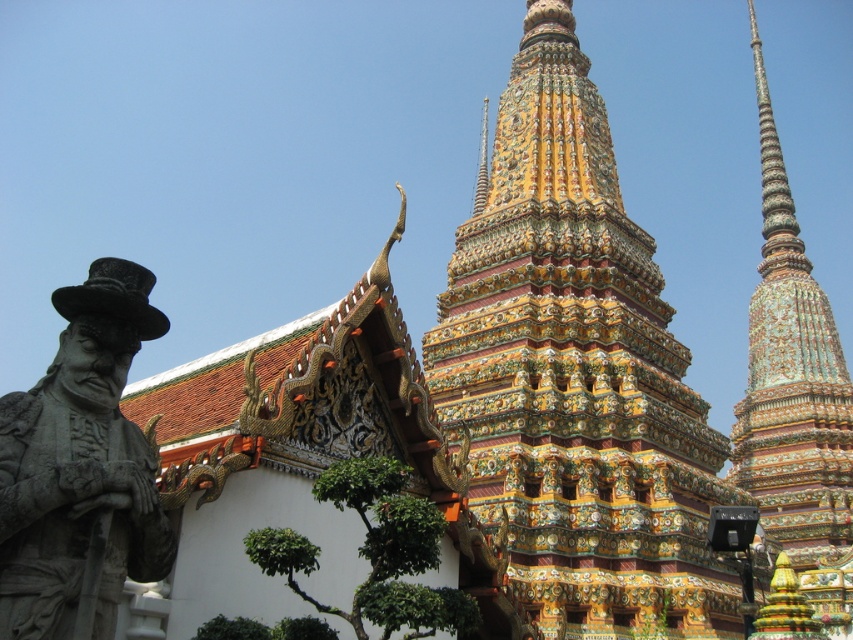
You are a tourist standing in front of the temple complex. You notice the multicolored mosaic temple at center and the gray stone statue at left. Which structure is taller?

The multicolored mosaic temple at center is much taller than the gray stone statue at left.

You are standing in front of the temple structure and want to take a photo of the multicolored mosaic stupa at center without the gray stone statue at left appearing in the background. Is the statue currently positioned in a way that would block your view of the stupa?

The gray stone statue at left is in front of the multicolored mosaic stupa at center, so it would block the view of the stupa. To take a photo without the statue in the background, you would need to move around it or adjust your angle to ensure the stupa is visible behind it.